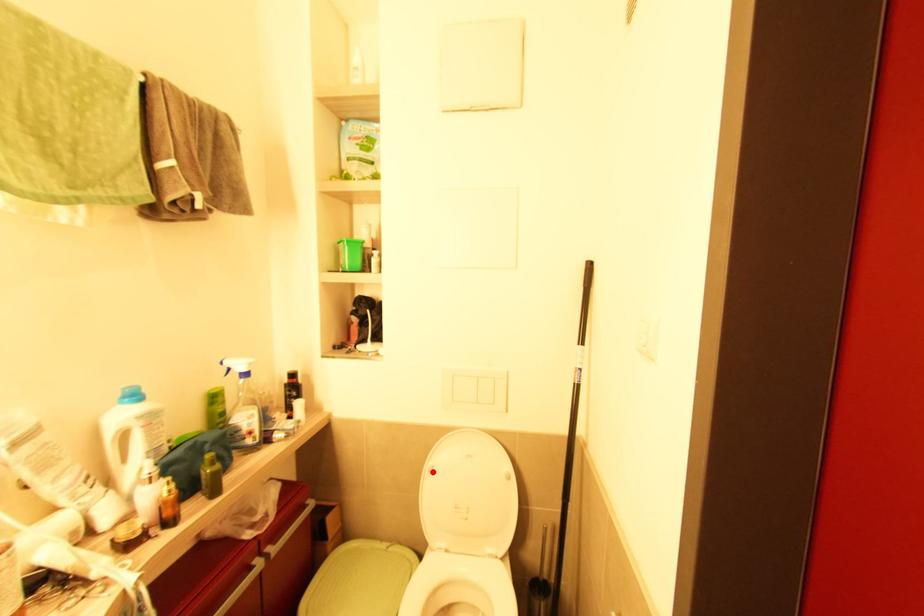
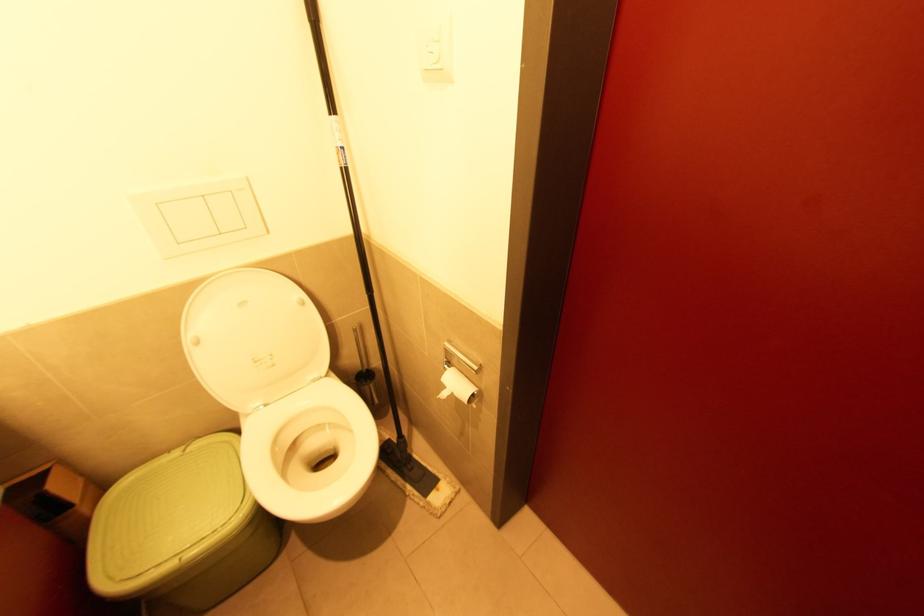
Question: I am providing you with two images of the same scene from different viewpoints. In image1, a red point is highlighted. Considering the same 3D point in image2, which of the following is correct?

Choices:
 (A) It is closer
 (B) It is farther

Answer: (A)